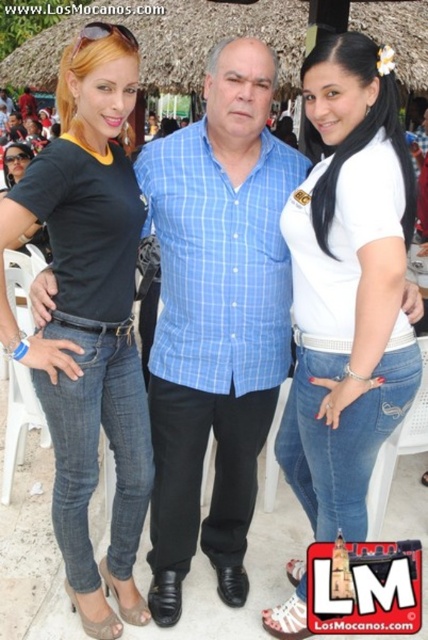
You are a photographer setting up for a group shot. You have two subjects wearing the blue checkered shirt at center and the matte black shirt at left. To ensure both are in focus, you need the distance between them to be at least 18 inches. Based on the scene description, will this requirement be met?

The distance between the blue checkered shirt at center and the matte black shirt at left is 16.00 inches, which is less than the required 18 inches. Therefore, the requirement will not be met.

You are a photographer trying to arrange the subjects for a group photo. You notice the white matte shirt at center and the matte black shirt at left. Which shirt is narrower in width?

The white matte shirt at center is thinner than the matte black shirt at left, so the white matte shirt at center is narrower in width.